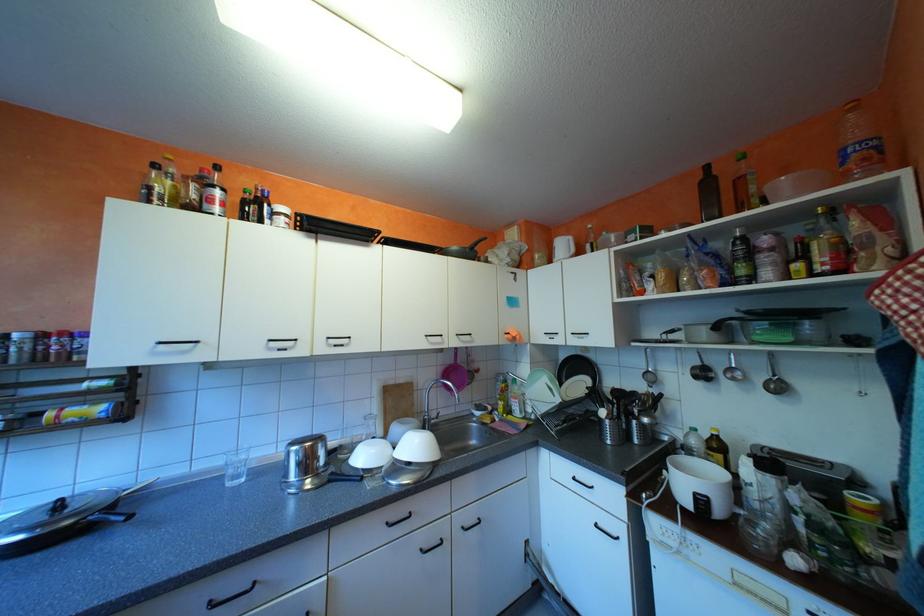
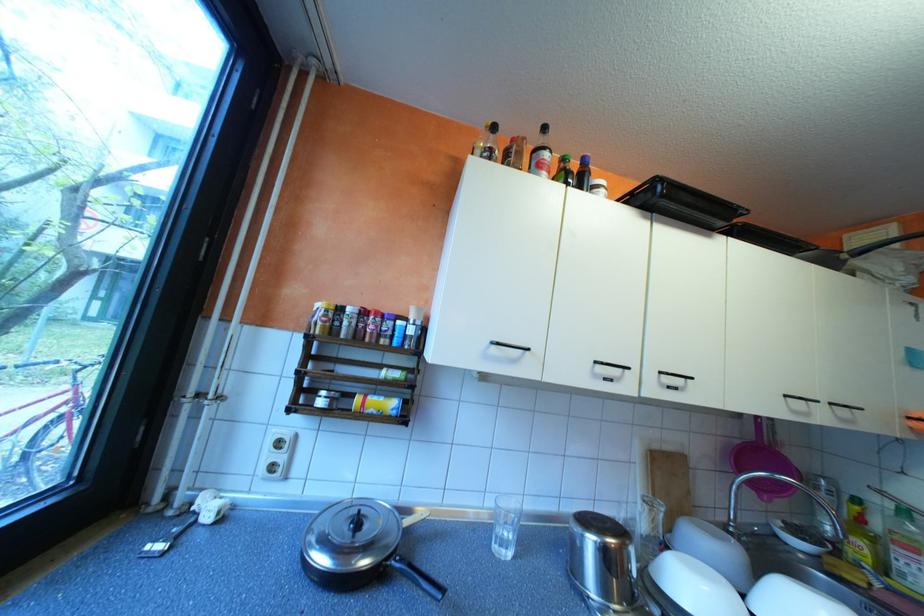
Locate, in the second image, the point that corresponds to (x=512, y=400) in the first image.

(871, 541)